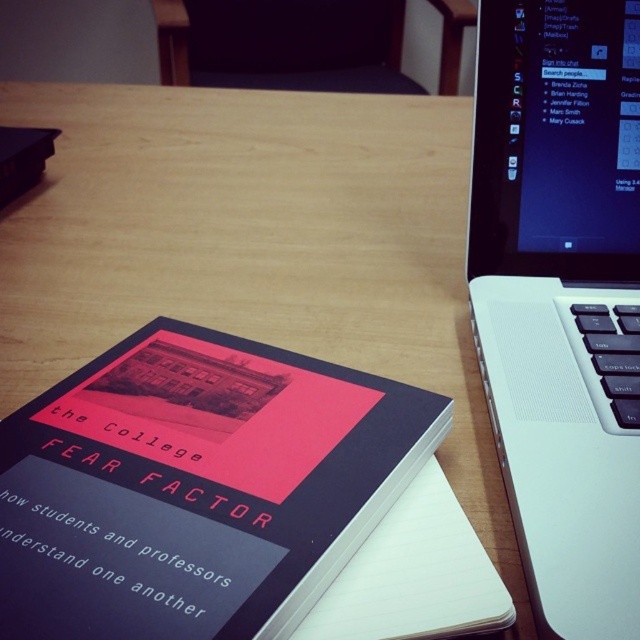
Question: Which of the following is the farthest from the observer?

Choices:
 (A) (410, 579)
 (B) (577, 472)
 (C) (102, 556)

Answer: (B)

Question: From the image, what is the correct spatial relationship of matte black book at center-left in relation to white plastic laptop at upper right?

Choices:
 (A) above
 (B) below

Answer: (B)

Question: Does white plastic laptop at upper right appear on the left side of white paper at center?

Choices:
 (A) no
 (B) yes

Answer: (A)

Question: Which point is closer to the camera taking this photo?

Choices:
 (A) (627, 64)
 (B) (392, 509)
 (C) (368, 490)

Answer: (C)

Question: Is white plastic laptop at upper right behind white paper at center?

Choices:
 (A) yes
 (B) no

Answer: (B)

Question: Estimate the real-world distances between objects in this image. Which object is closer to the white paper at center?

Choices:
 (A) white plastic laptop at upper right
 (B) matte black book at center-left

Answer: (B)